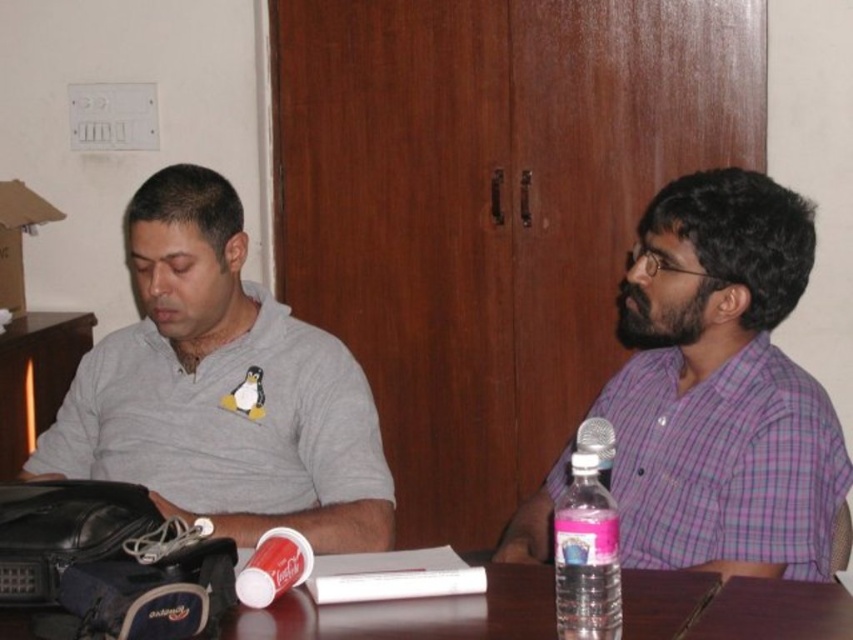
Question: Is gray matte shirt at left below silver metallic microphone at right?

Choices:
 (A) yes
 (B) no

Answer: (B)

Question: Does gray matte shirt at left come in front of pink translucent water bottle at right?

Choices:
 (A) no
 (B) yes

Answer: (A)

Question: Which point is closer to the camera?

Choices:
 (A) (566, 525)
 (B) (578, 440)

Answer: (A)

Question: Which point is farther from the camera taking this photo?

Choices:
 (A) (724, 548)
 (B) (610, 467)

Answer: (B)

Question: Which point is farther to the camera?

Choices:
 (A) (163, 317)
 (B) (808, 563)

Answer: (A)

Question: Is smooth wooden table at center below pink translucent water bottle at right?

Choices:
 (A) no
 (B) yes

Answer: (B)